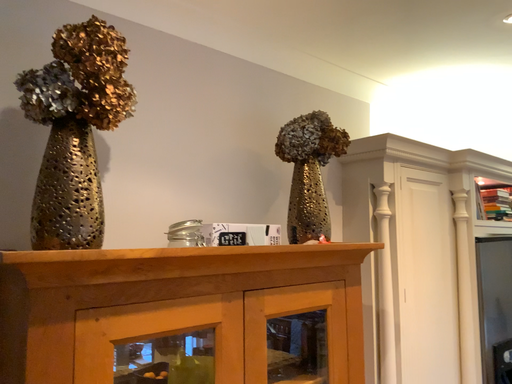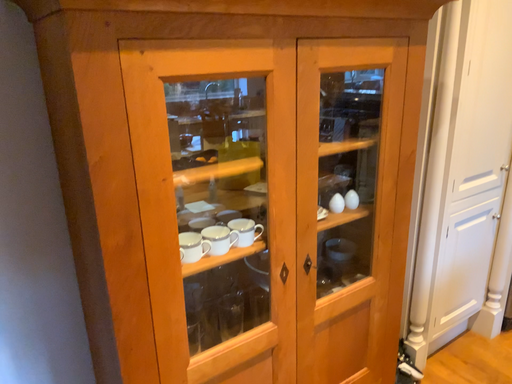
Question: How did the camera likely rotate when shooting the video?

Choices:
 (A) rotated downward
 (B) rotated upward

Answer: (A)